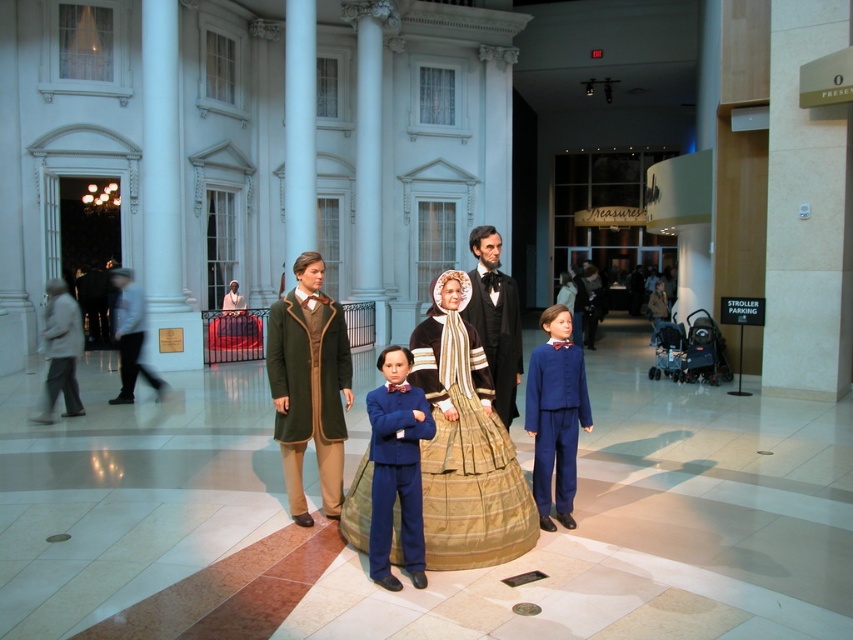
Question: Which point appears farthest from the camera in this image?

Choices:
 (A) (376, 579)
 (B) (128, 371)

Answer: (B)

Question: Can you confirm if navy blue fabric business suit at center is positioned to the left of blue wool suit at center?

Choices:
 (A) no
 (B) yes

Answer: (B)

Question: Observing the image, what is the correct spatial positioning of blue wool suit at center in reference to green wool coat at left?

Choices:
 (A) above
 (B) below

Answer: (A)

Question: Based on their relative distances, which object is nearer to the navy blue fabric business suit at center?

Choices:
 (A) blue wool suit at center
 (B) matte black suit at center
 (C) matte brown dress at center
 (D) blue fabric suit at center

Answer: (B)

Question: Which object appears closest to the camera in this image?

Choices:
 (A) navy blue fabric business suit at center
 (B) gold textured dress at center

Answer: (B)

Question: Is matte brown dress at center wider than blue fabric suit at center?

Choices:
 (A) no
 (B) yes

Answer: (B)